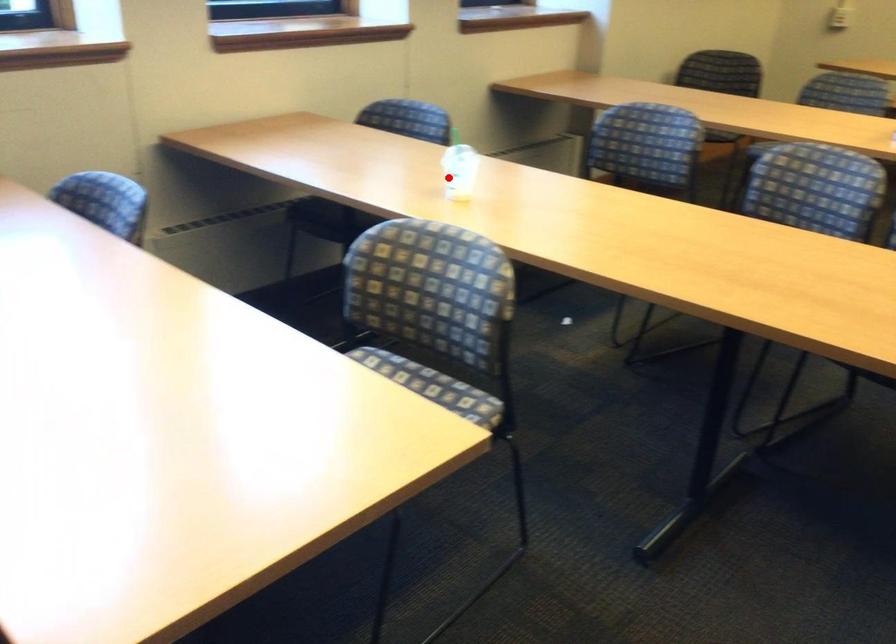
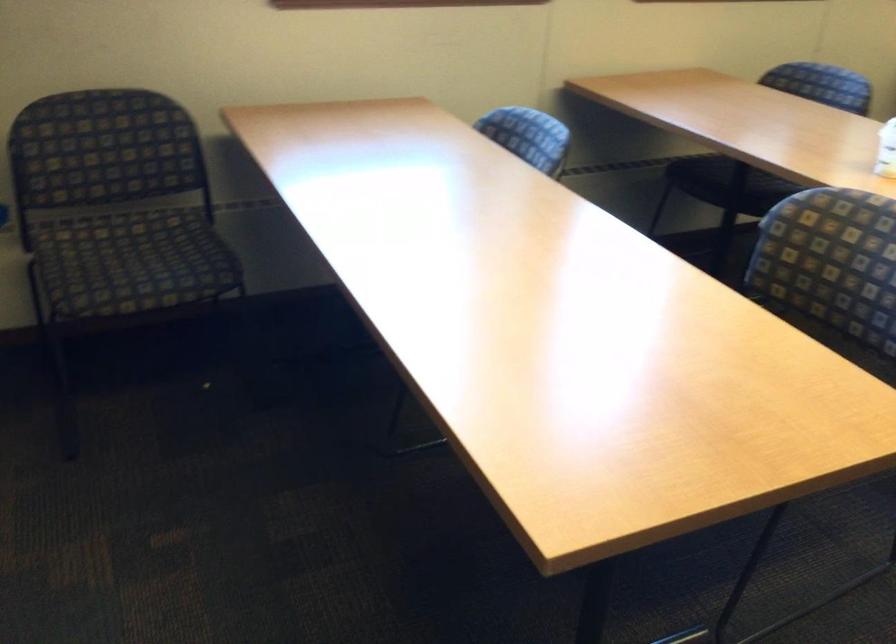
Question: I am providing you with two images of the same scene from different viewpoints. A red point is shown in image1. For the corresponding object point in image2, is it positioned nearer or farther from the camera?

Choices:
 (A) Nearer
 (B) Farther

Answer: (A)